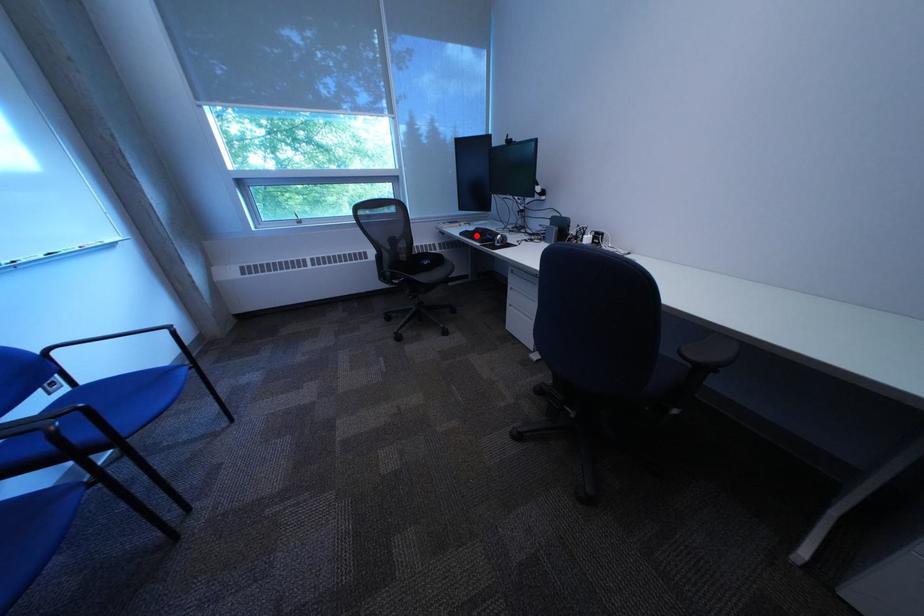
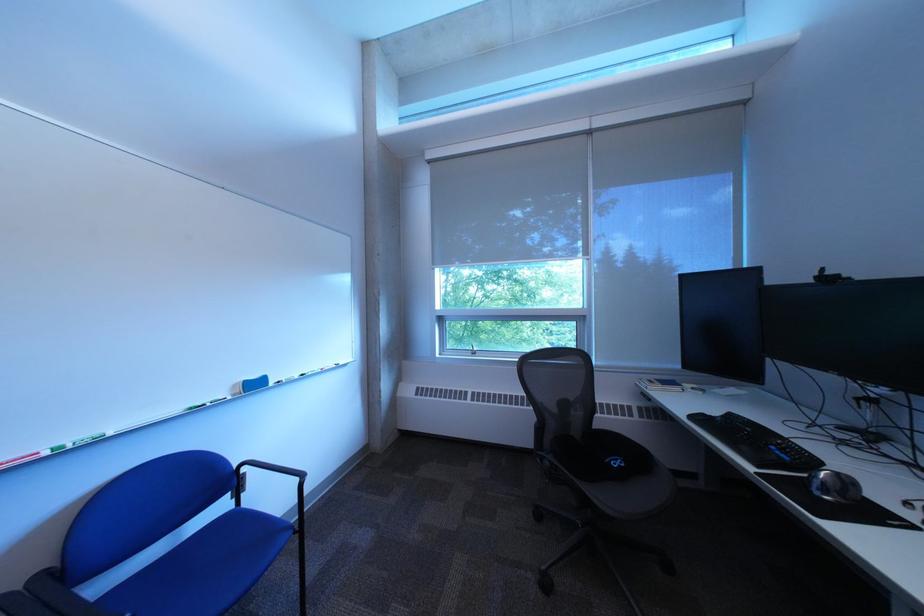
In the second image, find the point that corresponds to the highlighted location in the first image.

(708, 419)